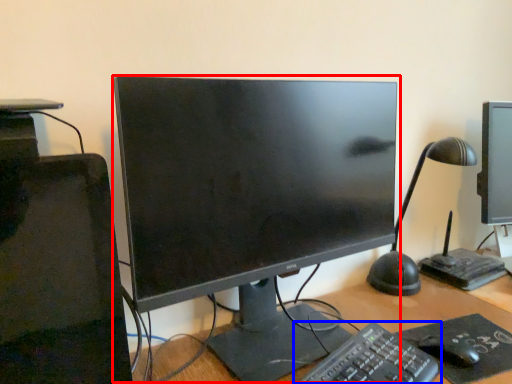
Question: Which object is closer to the camera taking this photo, computer monitor (highlighted by a red box) or computer keyboard (highlighted by a blue box)?

Choices:
 (A) computer monitor
 (B) computer keyboard

Answer: (B)